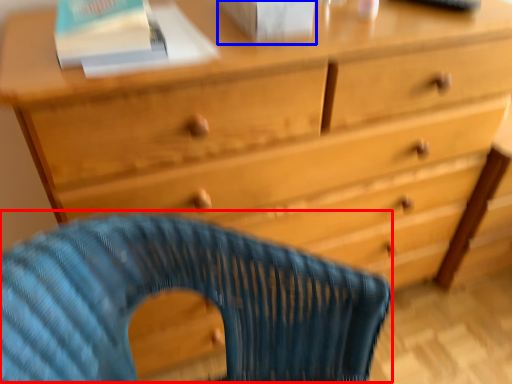
Question: Which of the following is the farthest to the observer, rocking chair (highlighted by a red box) or paperback book (highlighted by a blue box)?

Choices:
 (A) rocking chair
 (B) paperback book

Answer: (B)